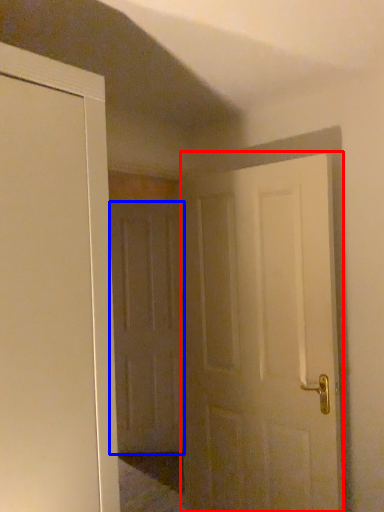
Question: Which of the following is the farthest to the observer, door (highlighted by a red box) or door (highlighted by a blue box)?

Choices:
 (A) door
 (B) door

Answer: (B)